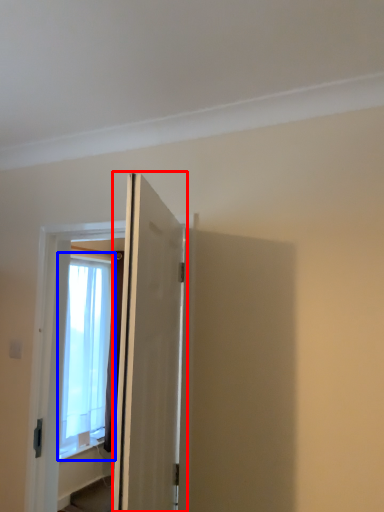
Question: Which object appears farthest to the camera in this image, door (highlighted by a red box) or window (highlighted by a blue box)?

Choices:
 (A) door
 (B) window

Answer: (B)